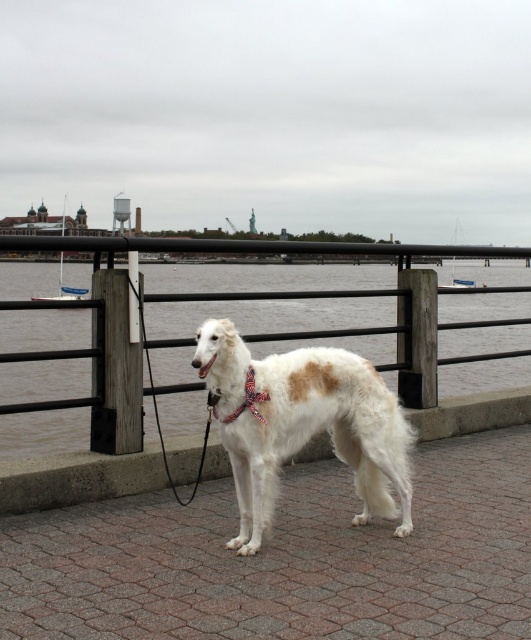
Question: Which point appears farthest from the camera in this image?

Choices:
 (A) (42, 561)
 (B) (76, 436)
 (C) (116, 237)

Answer: (B)

Question: Is white water at center positioned before red satin bow tie at center?

Choices:
 (A) no
 (B) yes

Answer: (A)

Question: Estimate the real-world distances between objects in this image. Which object is farther from the red satin bow tie at center?

Choices:
 (A) black metal railing at center
 (B) white brick pavement at center

Answer: (A)

Question: Is white brick pavement at center above white water at center?

Choices:
 (A) yes
 (B) no

Answer: (B)

Question: Among these points, which one is nearest to the camera?

Choices:
 (A) (85, 250)
 (B) (92, 557)

Answer: (B)

Question: Is white fur dog at center to the right of black rubber leash at center from the viewer's perspective?

Choices:
 (A) yes
 (B) no

Answer: (A)